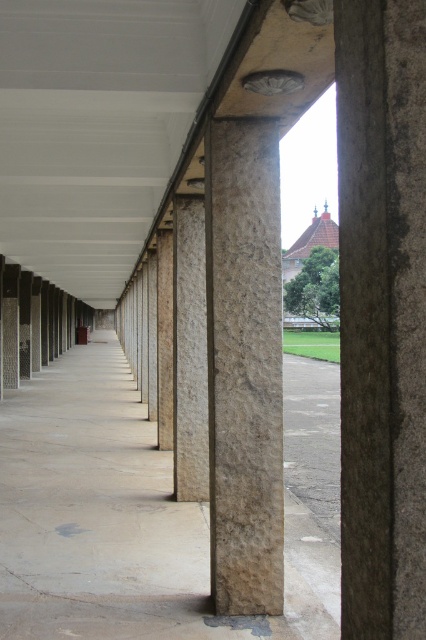
Question: Which point is closer to the camera taking this photo?

Choices:
 (A) (216, 561)
 (B) (138, 468)

Answer: (A)

Question: Among these points, which one is farthest from the camera?

Choices:
 (A) (258, 500)
 (B) (63, 400)

Answer: (B)

Question: Considering the relative positions of natural stone column at center and brown rough stone column at center in the image provided, where is natural stone column at center located with respect to brown rough stone column at center?

Choices:
 (A) above
 (B) below

Answer: (B)

Question: Which point is closer to the camera taking this photo?

Choices:
 (A) (219, 483)
 (B) (74, 381)

Answer: (A)

Question: Does natural stone column at center have a greater width compared to brown rough stone column at center?

Choices:
 (A) no
 (B) yes

Answer: (B)

Question: Does natural stone column at center have a larger size compared to brown rough stone column at center?

Choices:
 (A) yes
 (B) no

Answer: (A)